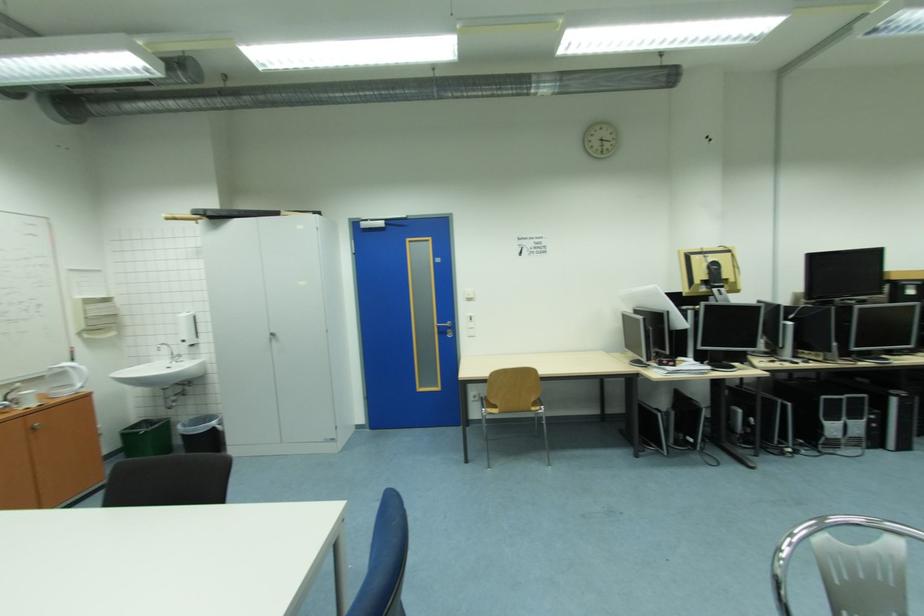
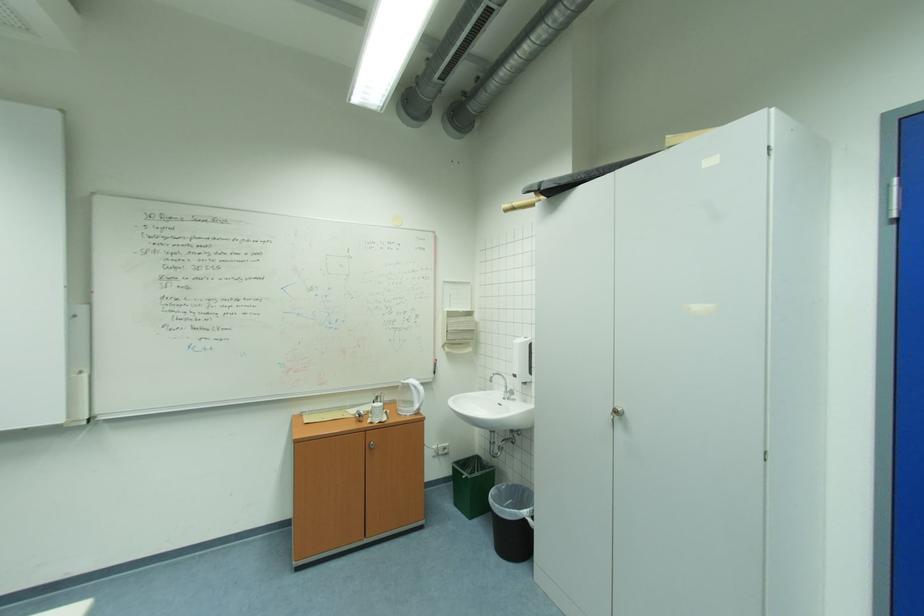
Locate, in the second image, the point that corresponds to [27,410] in the first image.

(377, 422)